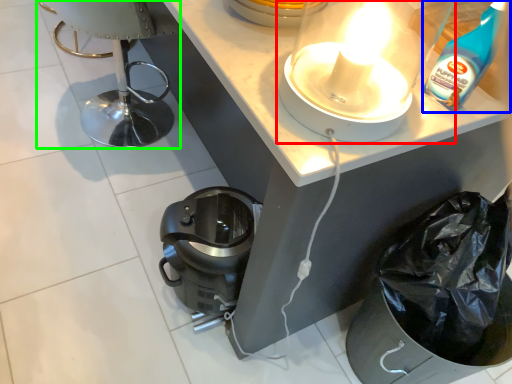
Question: Which object is positioned closest to kitchen appliance (highlighted by a red box)? Select from cleaning product (highlighted by a blue box) and swivel chair (highlighted by a green box).

Choices:
 (A) cleaning product
 (B) swivel chair

Answer: (A)